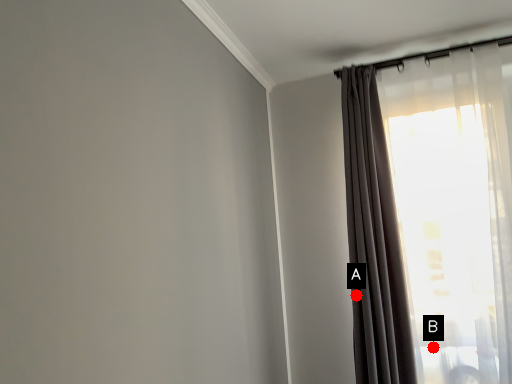
Question: Two points are circled on the image, labeled by A and B beside each circle. Which point is farther from the camera taking this photo?

Choices:
 (A) A is further
 (B) B is further

Answer: (A)